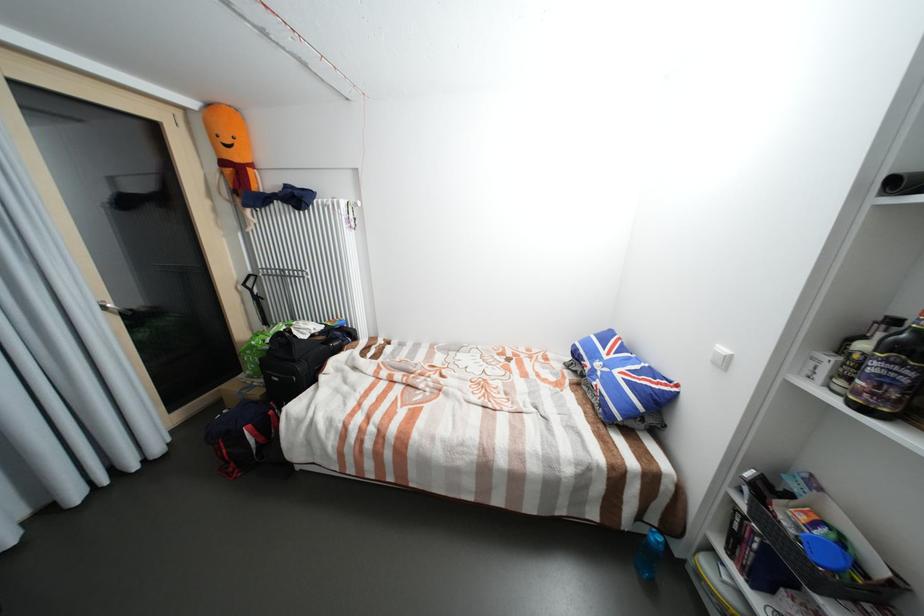
This screenshot has height=616, width=924. I want to click on suitcase handle, so click(309, 326).